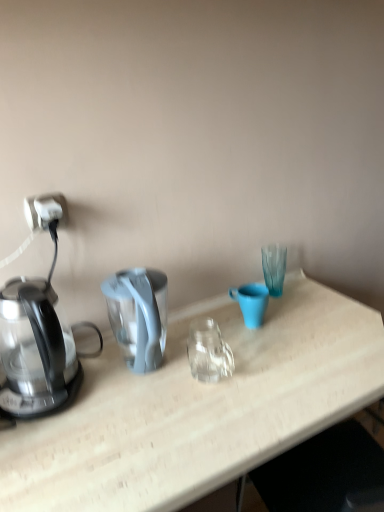
Question: Can you confirm if transparent glass kettle at left is wider than matte blue mug at center?

Choices:
 (A) no
 (B) yes

Answer: (B)

Question: From the image's perspective, would you say transparent glass kettle at left is shown under matte blue mug at center?

Choices:
 (A) no
 (B) yes

Answer: (B)

Question: Is transparent glass kettle at left located outside matte blue mug at center?

Choices:
 (A) yes
 (B) no

Answer: (A)

Question: From a real-world perspective, is transparent glass kettle at left located higher than matte blue mug at center?

Choices:
 (A) yes
 (B) no

Answer: (A)

Question: Considering the relative sizes of transparent glass kettle at left and matte blue mug at center in the image provided, is transparent glass kettle at left taller than matte blue mug at center?

Choices:
 (A) yes
 (B) no

Answer: (A)

Question: Can you confirm if transparent glass kettle at left is positioned to the left of matte blue mug at center?

Choices:
 (A) yes
 (B) no

Answer: (A)

Question: Is white plastic power outlet at left thinner than transparent glass kettle at left?

Choices:
 (A) yes
 (B) no

Answer: (A)

Question: Is white plastic power outlet at left positioned behind transparent glass kettle at left?

Choices:
 (A) yes
 (B) no

Answer: (A)

Question: Can you confirm if white plastic power outlet at left is shorter than transparent glass kettle at left?

Choices:
 (A) no
 (B) yes

Answer: (B)

Question: From a real-world perspective, is white plastic power outlet at left located higher than transparent glass kettle at left?

Choices:
 (A) yes
 (B) no

Answer: (A)

Question: From a real-world perspective, is white plastic power outlet at left beneath transparent glass kettle at left?

Choices:
 (A) no
 (B) yes

Answer: (A)

Question: Are white plastic power outlet at left and transparent glass kettle at left located far from each other?

Choices:
 (A) yes
 (B) no

Answer: (B)

Question: From a real-world perspective, is matte blue mug at center on transparent glass kettle at left?

Choices:
 (A) no
 (B) yes

Answer: (A)